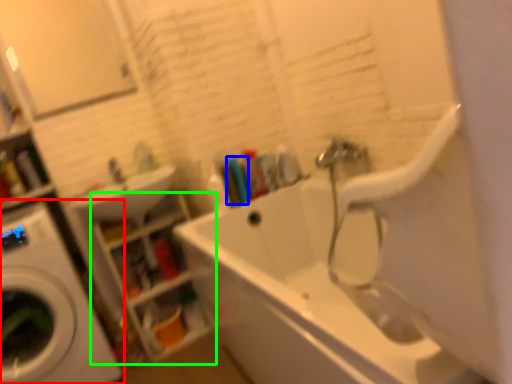
Question: Which object is positioned closest to washing machine (highlighted by a red box)? Select from toiletry (highlighted by a blue box) and shelf (highlighted by a green box).

Choices:
 (A) toiletry
 (B) shelf

Answer: (B)